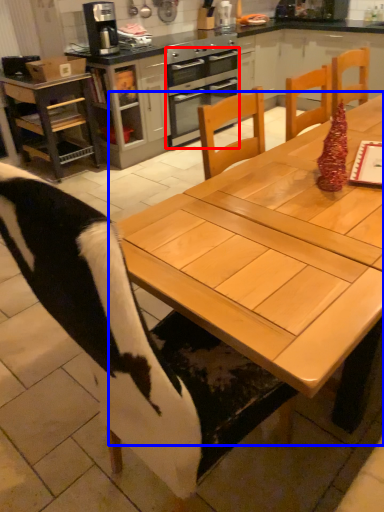
Question: Which point is further to the camera, oven (highlighted by a red box) or table (highlighted by a blue box)?

Choices:
 (A) oven
 (B) table

Answer: (A)